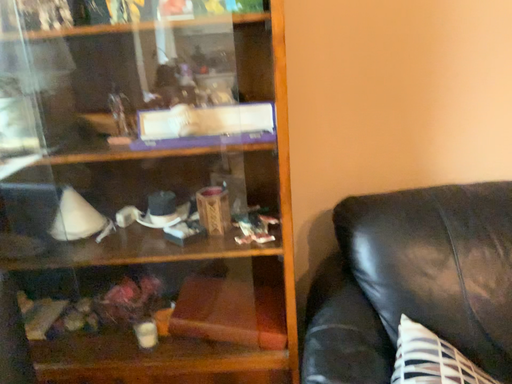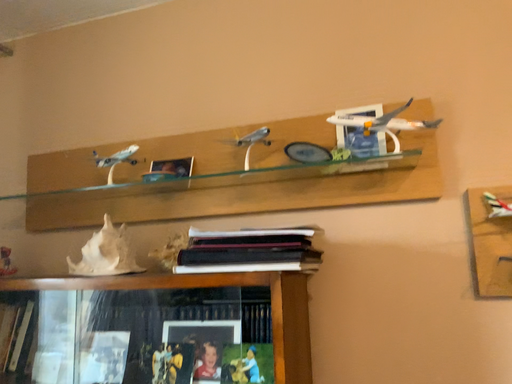
Question: How did the camera likely rotate when shooting the video?

Choices:
 (A) rotated downward
 (B) rotated upward

Answer: (B)